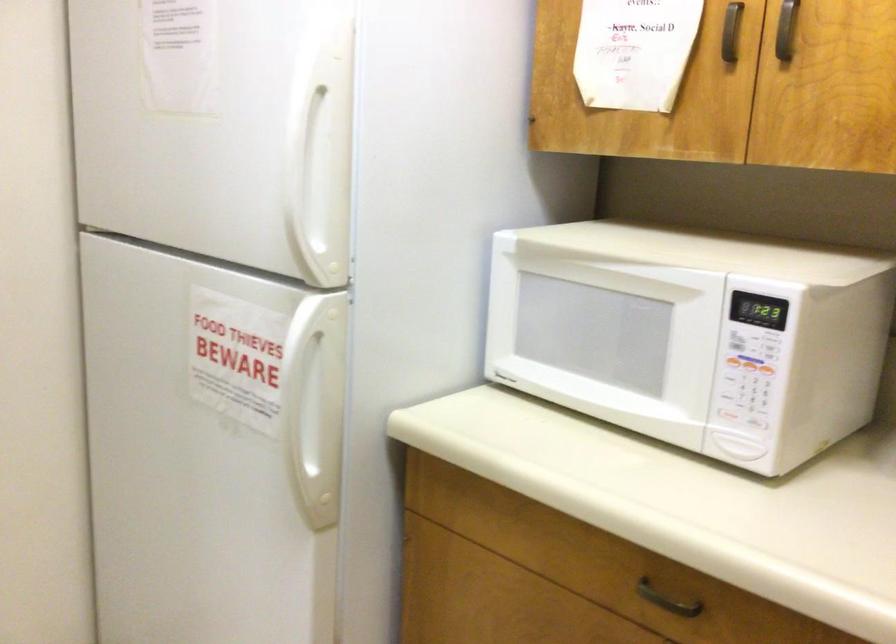
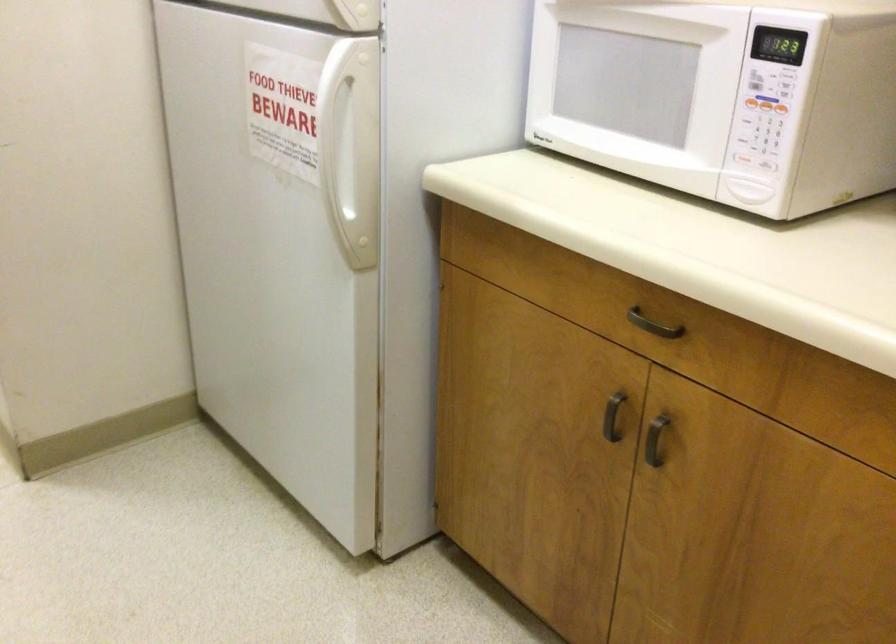
In a continuous first-person perspective shot, in which direction is the camera moving?

The movement direction of the cameraman is right, backward.